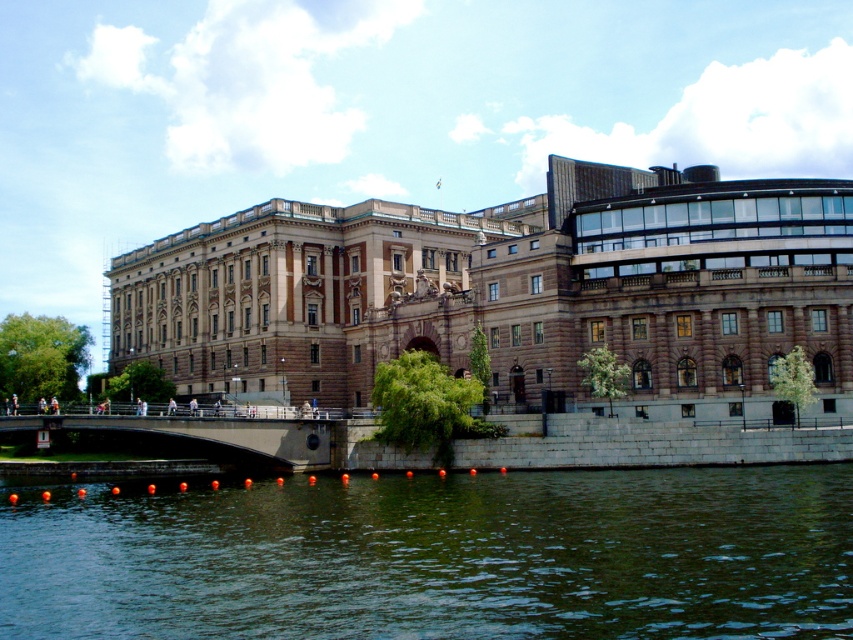
Consider the image. You are a boat captain trying to navigate through the area. You have a boat that is 10 meters wide. Can you safely pass through the space between the greenish water at lower center and the concrete bridge at center?

The greenish water at lower center might be wider than concrete bridge at center. Since the boat is 10 meters wide, it depends on the actual width of the water. If the water is indeed wider than the bridge, then the boat can pass safely. However, if the bridge is narrower, it might not fit. The exact width isn

You are standing on the waterfront and want to take a photo of the greenish water at lower center and the concrete bridge at center. Which object will appear larger in your photo?

The greenish water at lower center will appear larger in the photo because it is closer to the viewer than the concrete bridge at center.

You are standing in front of the historic building and looking at the water. There are two points marked on the water surface, point (x=833, y=554) and point (x=109, y=424). Which point is closer to your eyes?

Point (x=833, y=554) is closer to the camera than point (x=109, y=424).